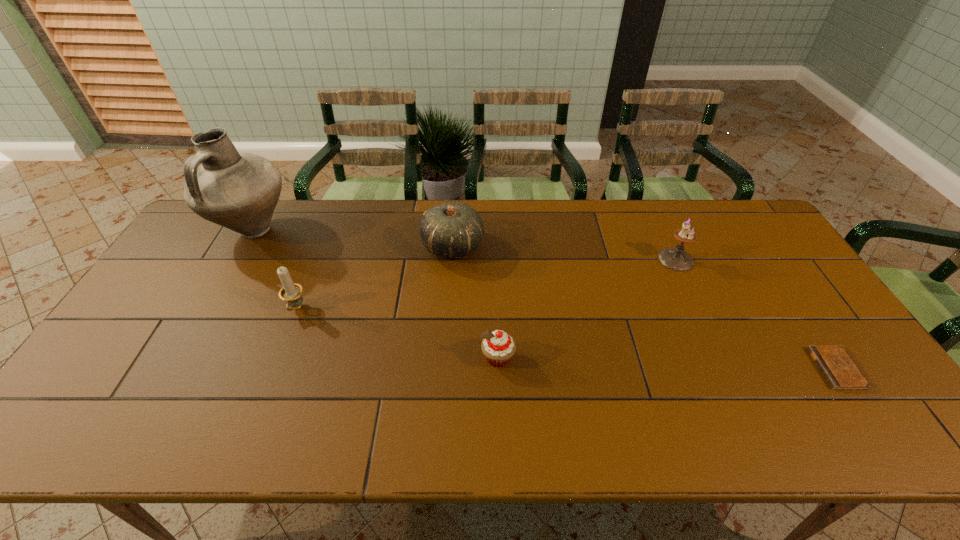
I want to click on the tallest object, so click(x=237, y=190).

This screenshot has width=960, height=540. What are the coordinates of `the leftmost object` in the screenshot? It's located at (237, 190).

Where is `the farther candle_holder`? the farther candle_holder is located at coordinates (677, 259).

Where is `the right candle_holder`? the right candle_holder is located at coordinates (677, 259).

The image size is (960, 540). I want to click on gourd, so click(x=452, y=229).

Find the location of a particular element. This screenshot has width=960, height=540. the fourth farthest object is located at coordinates (291, 292).

Locate an element on the screen. Image resolution: width=960 pixels, height=540 pixels. the left candle_holder is located at coordinates (291, 292).

Image resolution: width=960 pixels, height=540 pixels. I want to click on cupcake, so click(498, 347).

Identify the location of diary. This screenshot has height=540, width=960. (839, 370).

Locate an element on the screen. the shortest object is located at coordinates (839, 370).